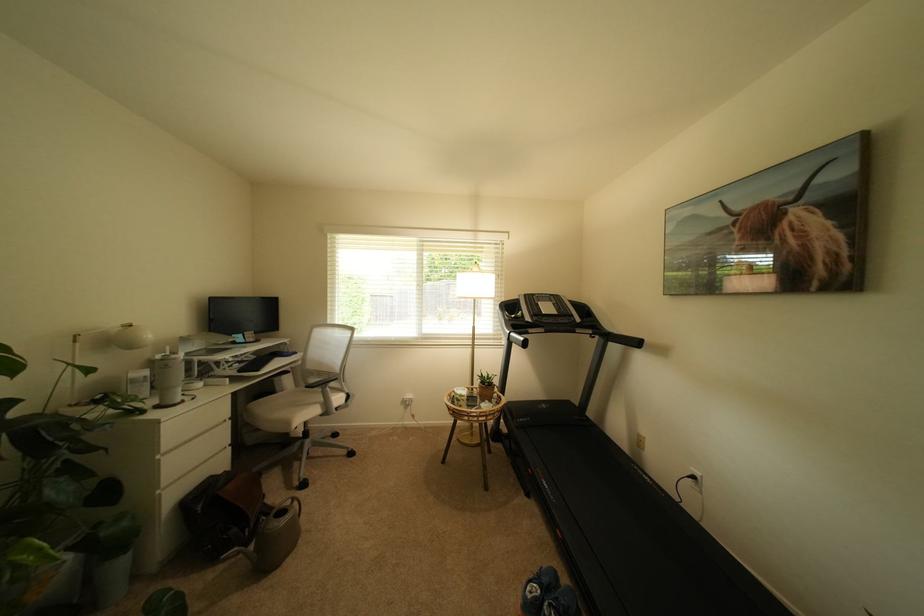
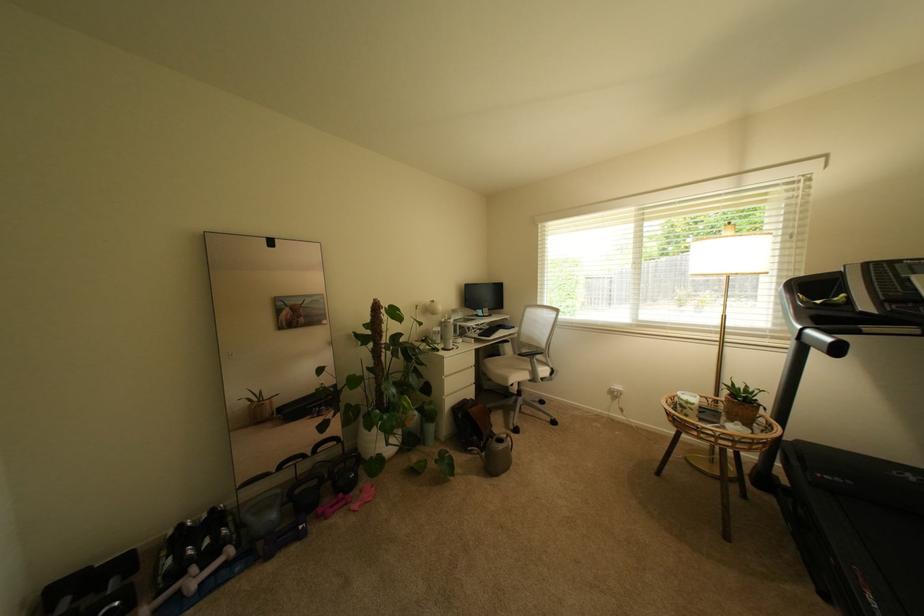
The point at (414,398) is marked in the first image. Where is the corresponding point in the second image?

(622, 389)